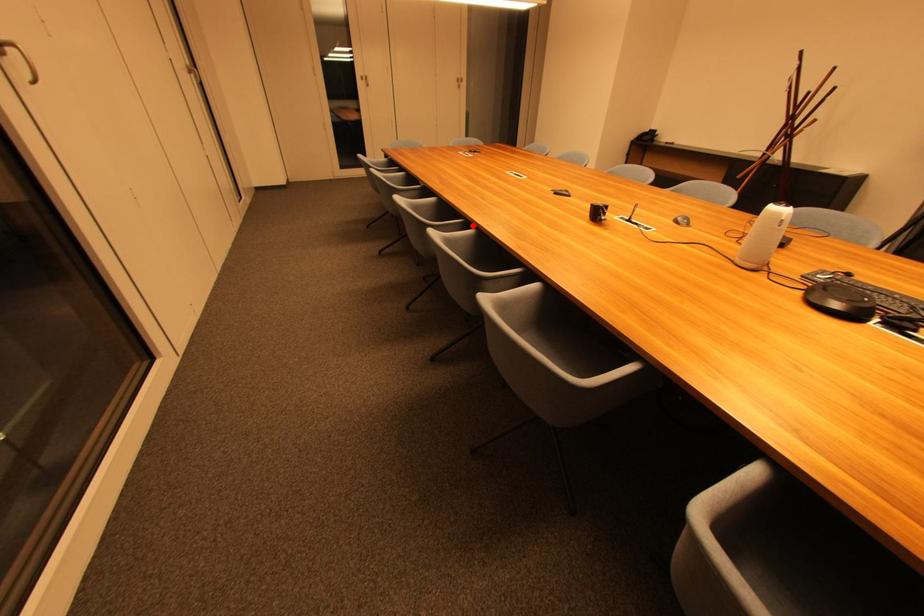
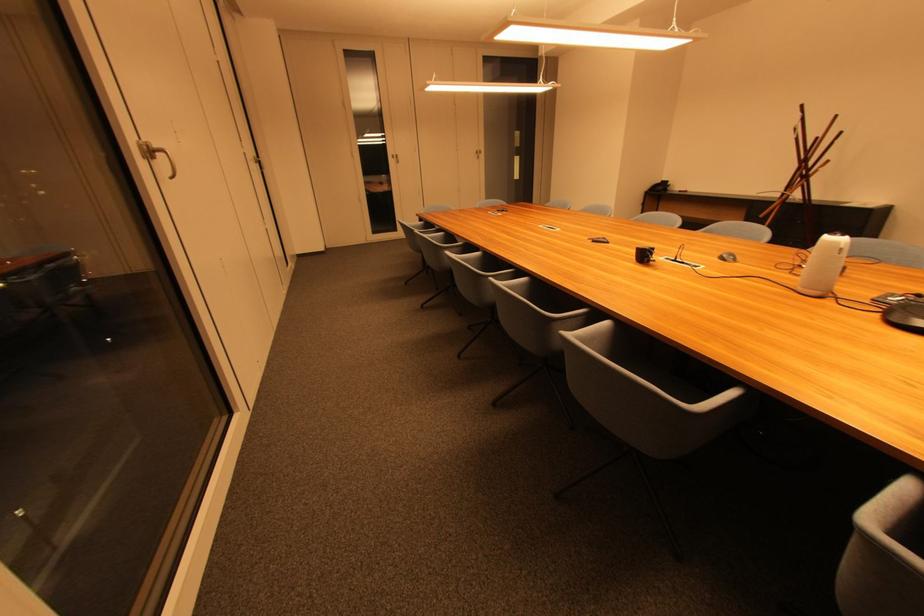
Find the pixel in the second image that matches the highlighted location in the first image.

(525, 274)